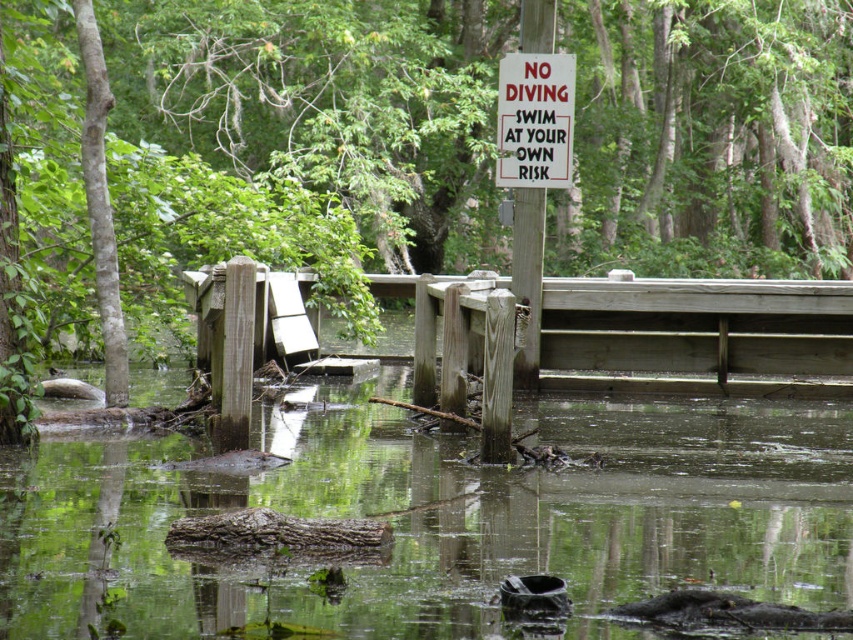
You are a bird flying over the serene waterway scene. You need to land on a spot where you can see both the green leafy tree at upper center and the clear water at center. Which object will appear larger in your view?

The green leafy tree at upper center will appear larger in your view because it is much taller than the clear water at center.

You are standing at the center of the wooden dock in the waterway scene. You notice a point marked at coordinates (305, 141). What object is located at that point?

The green leafy tree at upper center is located at point (305, 141).